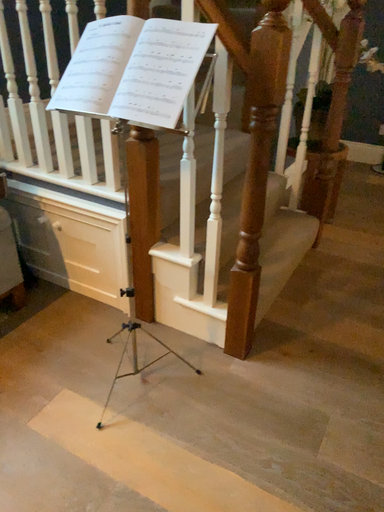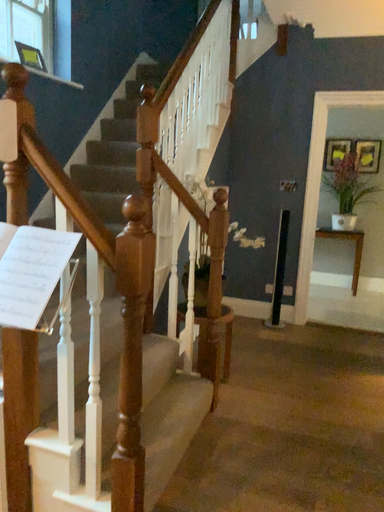
Question: Which way did the camera rotate in the video?

Choices:
 (A) rotated downward
 (B) rotated upward

Answer: (B)